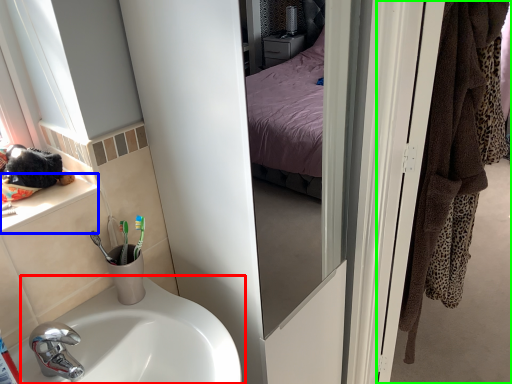
Question: Which object is the closest to the sink (highlighted by a red box)? Choose among these: window sill (highlighted by a blue box) or door (highlighted by a green box).

Choices:
 (A) window sill
 (B) door

Answer: (A)